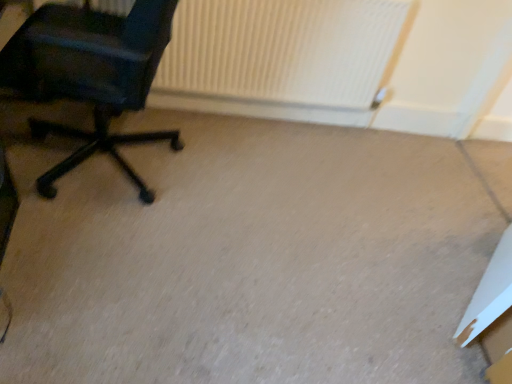
Find the location of a particular element. Image resolution: width=512 pixels, height=384 pixels. white ribbed radiator at upper center is located at coordinates (x=279, y=58).

Identify the location of matte black office chair at left. (90, 74).

The width and height of the screenshot is (512, 384). What do you see at coordinates (493, 313) in the screenshot? I see `white cardboard box at lower right` at bounding box center [493, 313].

Where is `white ribbed radiator at upper center`? white ribbed radiator at upper center is located at coordinates (279, 58).

Would you say matte black office chair at left is a long distance from white ribbed radiator at upper center?

They are positioned close to each other.

From a real-world perspective, is matte black office chair at left over white ribbed radiator at upper center?

Yes, from a real-world perspective, matte black office chair at left is above white ribbed radiator at upper center.

Does matte black office chair at left have a lesser width compared to white ribbed radiator at upper center?

Answer: In fact, matte black office chair at left might be wider than white ribbed radiator at upper center.

Does white cardboard box at lower right touch white ribbed radiator at upper center?

They are not placed beside each other.

Which is correct: white cardboard box at lower right is inside white ribbed radiator at upper center, or outside of it?

white cardboard box at lower right is not inside white ribbed radiator at upper center, it's outside.

Is point (500, 280) less distant than point (270, 93)?

Yes.

Where is `cardboard box below the white ribbed radiator at upper center (from the image's perspective)`? The width and height of the screenshot is (512, 384). cardboard box below the white ribbed radiator at upper center (from the image's perspective) is located at coordinates (493, 313).

Does white ribbed radiator at upper center appear on the right side of matte black office chair at left?

Yes.

Can you tell me how much white ribbed radiator at upper center and matte black office chair at left differ in facing direction?

They differ by 95.6 degrees in their facing directions.

From a real-world perspective, between white ribbed radiator at upper center and matte black office chair at left, who is vertically lower?

white ribbed radiator at upper center.

In order to click on chair above the white ribbed radiator at upper center (from a real-world perspective) in this screenshot , I will do `click(90, 74)`.

Does white ribbed radiator at upper center touch white cardboard box at lower right?

There is a gap between white ribbed radiator at upper center and white cardboard box at lower right.

At what (x,y) coordinates should I click in order to perform the action: click on cardboard box in front of the white ribbed radiator at upper center. Please return your answer as a coordinate pair (x, y). Looking at the image, I should click on (493, 313).

Which is more to the left, white ribbed radiator at upper center or white cardboard box at lower right?

Positioned to the left is white ribbed radiator at upper center.

Who is bigger, beige carpet at center or white ribbed radiator at upper center?

With larger size is beige carpet at center.

Is point (270, 321) less distant than point (344, 42)?

Yes, point (270, 321) is closer to viewer.

Would you say beige carpet at center is inside or outside white ribbed radiator at upper center?

beige carpet at center is not inside white ribbed radiator at upper center, it's outside.

Is beige carpet at center oriented towards white ribbed radiator at upper center?

No, beige carpet at center is not turned towards white ribbed radiator at upper center.

Is beige carpet at center with white cardboard box at lower right?

No, beige carpet at center is not next to white cardboard box at lower right.

Considering the sizes of beige carpet at center and white cardboard box at lower right in the image, is beige carpet at center bigger or smaller than white cardboard box at lower right?

beige carpet at center is bigger than white cardboard box at lower right.

Which object is thinner, beige carpet at center or white cardboard box at lower right?

white cardboard box at lower right.

Which point is more forward, (277, 367) or (469, 326)?

Point (277, 367)

From the picture: Is white cardboard box at lower right not close to matte black office chair at left?

white cardboard box at lower right is far away from matte black office chair at left.

Between white cardboard box at lower right and matte black office chair at left, which one is positioned behind?

white cardboard box at lower right is behind.

Locate an element on the screen. radiator below the matte black office chair at left (from a real-world perspective) is located at coordinates tap(279, 58).

The image size is (512, 384). Find the location of `radiator above the white cardboard box at lower right (from the image's perspective)`. radiator above the white cardboard box at lower right (from the image's perspective) is located at coordinates (279, 58).

From the image, which object appears to be farther from white cardboard box at lower right, matte black office chair at left or white ribbed radiator at upper center?

Based on the image, matte black office chair at left appears to be further to white cardboard box at lower right.

When comparing their distances from white ribbed radiator at upper center, does beige carpet at center or matte black office chair at left seem closer?

Among the two, beige carpet at center is located nearer to white ribbed radiator at upper center.

Looking at this image, from the image, which object appears to be farther from white ribbed radiator at upper center, beige carpet at center or white cardboard box at lower right?

white cardboard box at lower right.

From the image, which object appears to be nearer to white cardboard box at lower right, matte black office chair at left or beige carpet at center?

beige carpet at center lies closer to white cardboard box at lower right than the other object.

Consider the image. When comparing their distances from beige carpet at center, does white cardboard box at lower right or matte black office chair at left seem closer?

white cardboard box at lower right lies closer to beige carpet at center than the other object.

From the image, which object appears to be farther from matte black office chair at left, beige carpet at center or white ribbed radiator at upper center?

beige carpet at center is positioned further to the anchor matte black office chair at left.

Based on their spatial positions, is white cardboard box at lower right or white ribbed radiator at upper center closer to beige carpet at center?

white cardboard box at lower right is closer to beige carpet at center.

Which object lies nearer to the anchor point white ribbed radiator at upper center, matte black office chair at left or white cardboard box at lower right?

matte black office chair at left lies closer to white ribbed radiator at upper center than the other object.

You are a GUI agent. You are given a task and a screenshot of the screen. Output one action in this format:
    pyautogui.click(x=<x>, y=<y>)
    Task: Click on the radiator situated between matte black office chair at left and white cardboard box at lower right from left to right
    The image size is (512, 384).
    Given the screenshot: What is the action you would take?
    pyautogui.click(x=279, y=58)

Locate an element on the screen. chair between white ribbed radiator at upper center and beige carpet at center in the vertical direction is located at coordinates (90, 74).

I want to click on concrete between matte black office chair at left and white cardboard box at lower right, so click(x=248, y=258).

Find the location of `concrete between white ribbed radiator at upper center and white cardboard box at lower right in the up-down direction`. concrete between white ribbed radiator at upper center and white cardboard box at lower right in the up-down direction is located at coordinates (248, 258).